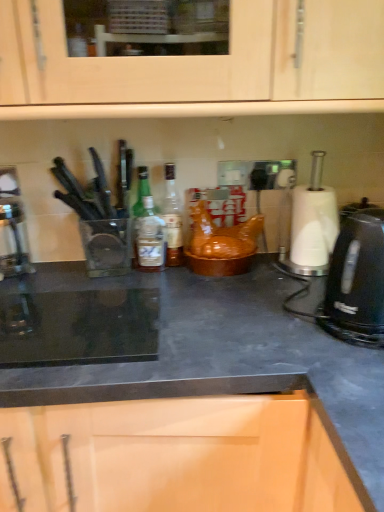
This screenshot has width=384, height=512. I want to click on vacant area that lies between black plastic kettle at right and green glass bottle at center, so click(x=257, y=296).